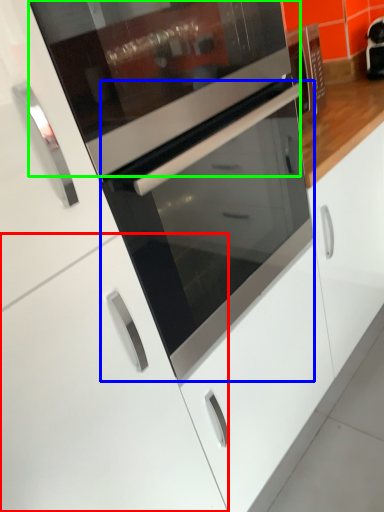
Question: Which is nearer to the cabinetry (highlighted by a red box)? oven (highlighted by a blue box) or appliance (highlighted by a green box).

Choices:
 (A) oven
 (B) appliance

Answer: (A)